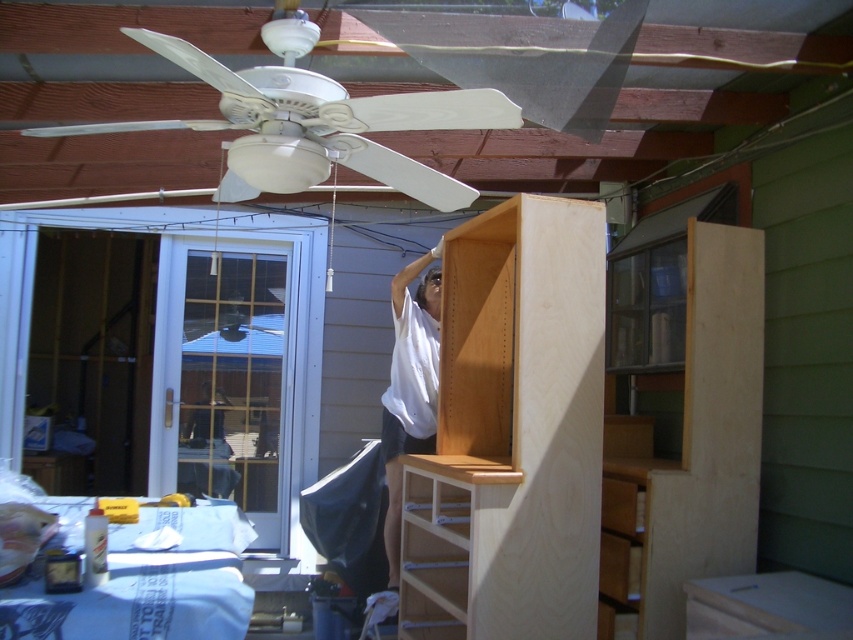
You are standing in the workshop and want to adjust the white matte ceiling fan at upper center. To reach it, you need to move past the white matte shirt at upper center. Is the ceiling fan closer to you than the shirt?

The white matte ceiling fan at upper center is closer to the viewer than the white matte shirt at upper center, so yes, the ceiling fan is closer to you than the shirt.

You are a safety inspector checking the workspace. You notice the white matte ceiling fan at upper center and the white matte shirt at upper center. Which object is located above the other?

The white matte ceiling fan at upper center is positioned over the white matte shirt at upper center.